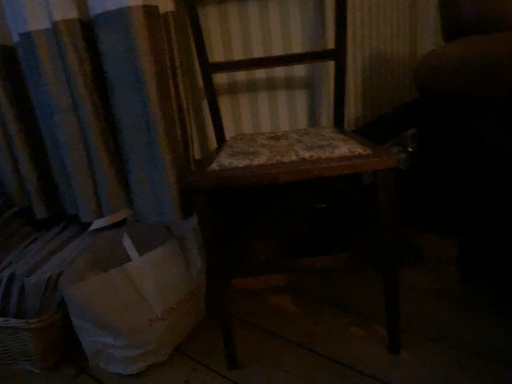
Question: Is white paper bag at lower left placed right next to wooden chair at center?

Choices:
 (A) no
 (B) yes

Answer: (A)

Question: From the image's perspective, is white paper bag at lower left above wooden chair at center?

Choices:
 (A) yes
 (B) no

Answer: (B)

Question: Does white paper bag at lower left have a lesser height compared to wooden chair at center?

Choices:
 (A) yes
 (B) no

Answer: (A)

Question: Considering the relative sizes of white paper bag at lower left and wooden chair at center in the image provided, is white paper bag at lower left taller than wooden chair at center?

Choices:
 (A) no
 (B) yes

Answer: (A)

Question: Is white paper bag at lower left positioned beyond the bounds of wooden chair at center?

Choices:
 (A) yes
 (B) no

Answer: (A)

Question: From a real-world perspective, is white paper bag at lower left physically above wooden chair at center?

Choices:
 (A) no
 (B) yes

Answer: (A)

Question: Can you confirm if wooden chair at center is smaller than white paper bag at lower left?

Choices:
 (A) no
 (B) yes

Answer: (A)

Question: Is wooden chair at center not within white paper bag at lower left?

Choices:
 (A) yes
 (B) no

Answer: (A)

Question: Are wooden chair at center and white paper bag at lower left located far from each other?

Choices:
 (A) no
 (B) yes

Answer: (A)

Question: Could you tell me if wooden chair at center is turned towards white paper bag at lower left?

Choices:
 (A) yes
 (B) no

Answer: (B)

Question: From a real-world perspective, is wooden chair at center over white paper bag at lower left?

Choices:
 (A) yes
 (B) no

Answer: (A)

Question: Is wooden chair at center positioned with its back to white paper bag at lower left?

Choices:
 (A) no
 (B) yes

Answer: (A)

Question: Would you say white paper bag at lower left is to the left or to the right of wooden chair at center in the picture?

Choices:
 (A) left
 (B) right

Answer: (A)